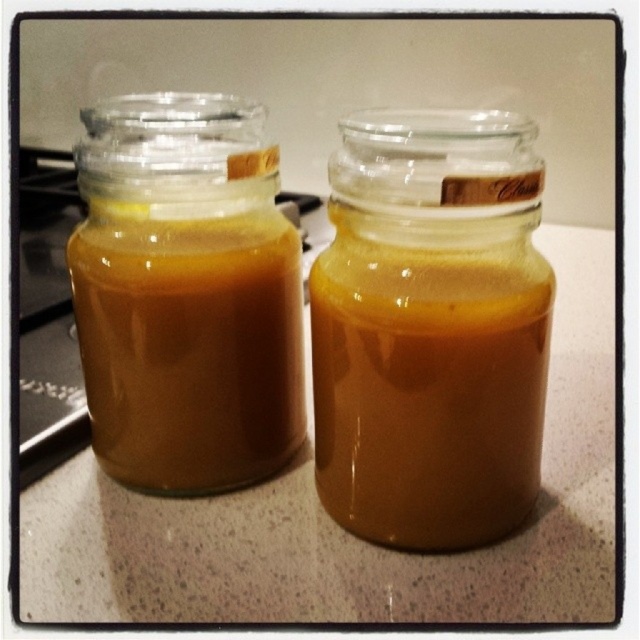
You are a bartender preparing a drink and need to pour the golden translucent liquid at center into the golden translucent jar at left. Based on their sizes, will the liquid fit into the jar?

The golden translucent liquid at center has a smaller size compared to golden translucent jar at left, so the liquid will fit into the jar since it is smaller than the jar.

You are a delivery person who needs to place a box on the countertop where the golden translucent liquid at center is located. The box requires a clear space of 24 inches from the liquid to avoid spills. Can you safely place the box here?

The golden translucent liquid at center is 23.79 inches away from the camera, which is less than the required 24 inches. Therefore, placing the box here would not meet the safety requirement.

You are a bartender preparing a drink and need to pour the golden translucent liquid at center into the golden translucent jar at left. Based on the image, will the liquid fit into the jar without spilling?

The golden translucent liquid at center has a width less than the golden translucent jar at left, so the liquid should fit into the jar without spilling.